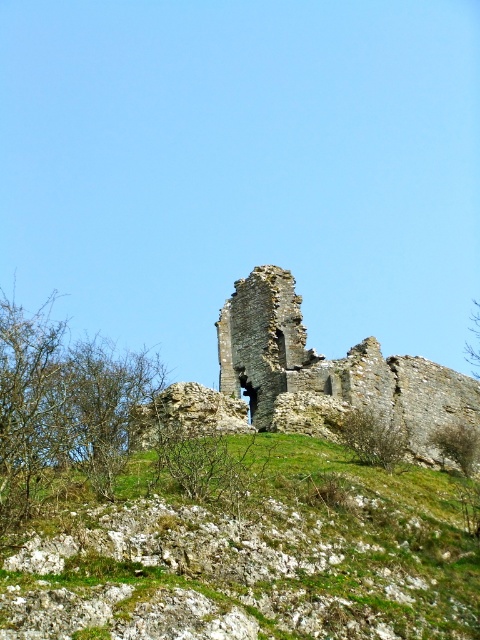
Between point (254, 604) and point (249, 403), which one is positioned in front?

Point (254, 604) is in front.

Between green grassy at center and rustic stone castle at center, which one appears on the right side from the viewer's perspective?

rustic stone castle at center is more to the right.

Image resolution: width=480 pixels, height=640 pixels. Describe the element at coordinates (248, 552) in the screenshot. I see `green grassy at center` at that location.

Find the location of a particular element. The height and width of the screenshot is (640, 480). green grassy at center is located at coordinates (248, 552).